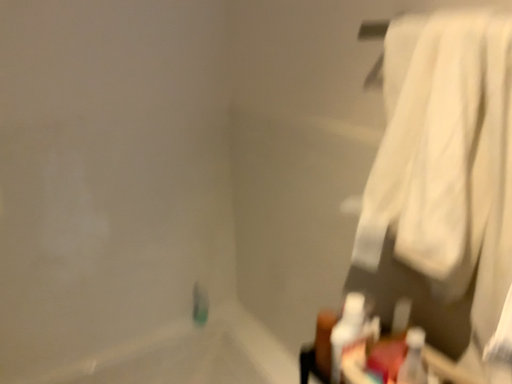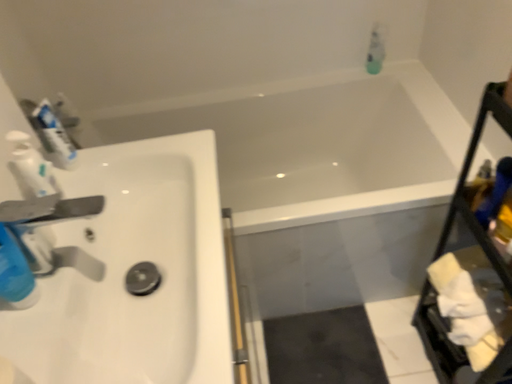
Question: How did the camera likely rotate when shooting the video?

Choices:
 (A) rotated upward
 (B) rotated downward

Answer: (B)